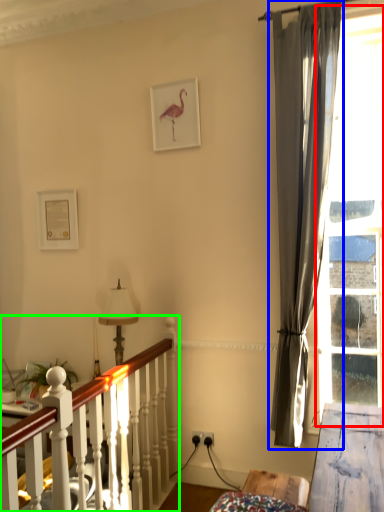
Question: Which object is positioned closest to bay window (highlighted by a red box)? Select from curtain (highlighted by a blue box) and bed frame (highlighted by a green box).

Choices:
 (A) curtain
 (B) bed frame

Answer: (A)